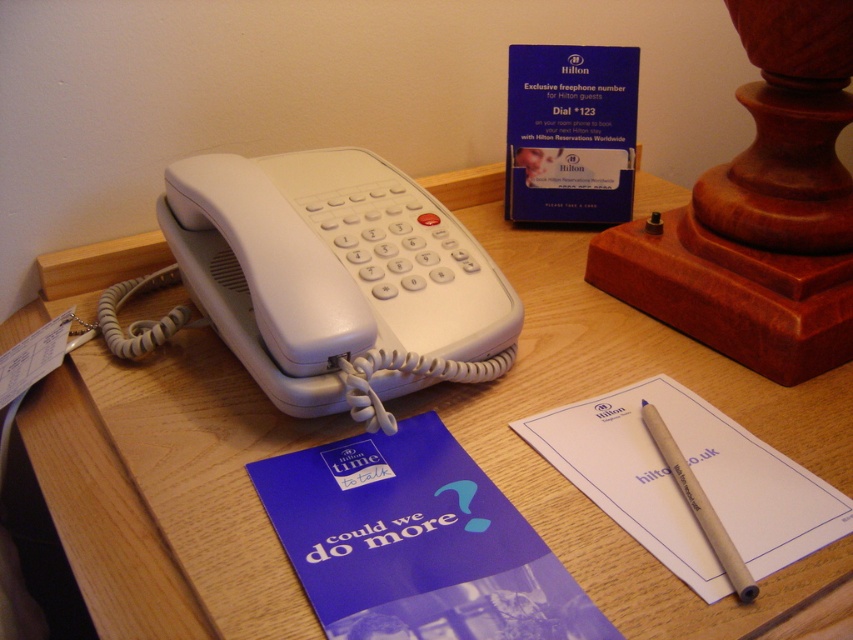
Does blue paper at center have a larger size compared to blue wood pen at center?

Indeed, blue paper at center has a larger size compared to blue wood pen at center.

Can you confirm if blue paper at center is shorter than blue wood pen at center?

In fact, blue paper at center may be taller than blue wood pen at center.

Which is in front, point (439, 621) or point (729, 540)?

Point (439, 621) is more forward.

Where is `blue paper at center`? The width and height of the screenshot is (853, 640). blue paper at center is located at coordinates (416, 541).

Which is in front, point (641, 502) or point (723, 547)?

Point (723, 547)

Does white paper at center have a greater width compared to blue wood pen at center?

Yes.

Does point (596, 401) lie behind point (743, 586)?

Yes, point (596, 401) is behind point (743, 586).

Find the location of a particular element. white paper at center is located at coordinates pyautogui.click(x=695, y=476).

Describe the element at coordinates (416, 541) in the screenshot. I see `blue paper at center` at that location.

Between blue paper at center and white paper at center, which one is positioned higher?

white paper at center

Measure the distance between point (x=607, y=627) and camera.

14.08 inches

You are a GUI agent. You are given a task and a screenshot of the screen. Output one action in this format:
    pyautogui.click(x=<x>, y=<y>)
    Task: Click on the blue paper at center
    
    Given the screenshot: What is the action you would take?
    pyautogui.click(x=416, y=541)